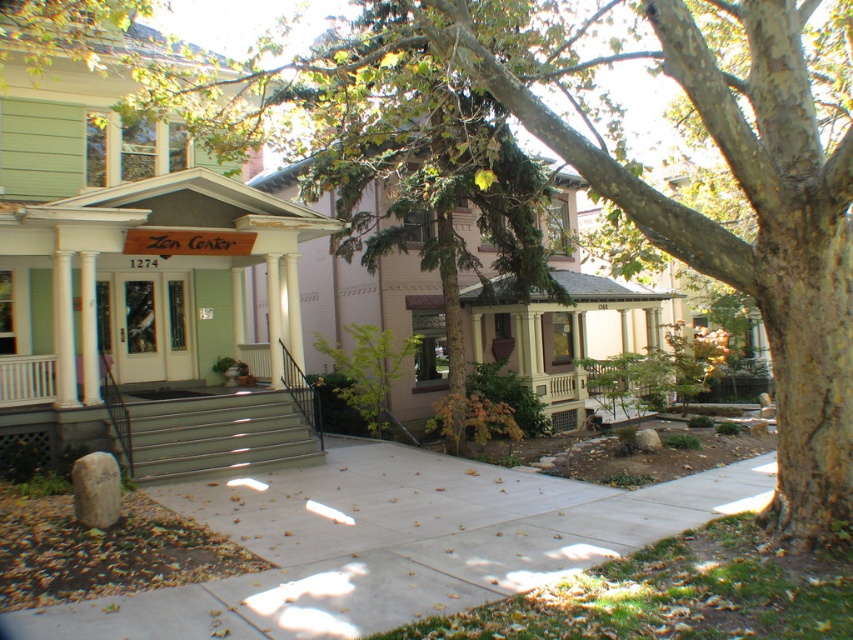
Which is below, concrete at center or metallic gray steps at center?

concrete at center is lower down.

Is concrete at center taller than metallic gray steps at center?

No, concrete at center is not taller than metallic gray steps at center.

Who is more distant from viewer, (381,611) or (16,438)?

The point (16,438) is behind.

This screenshot has width=853, height=640. In order to click on concrete at center in this screenshot , I will do `click(393, 544)`.